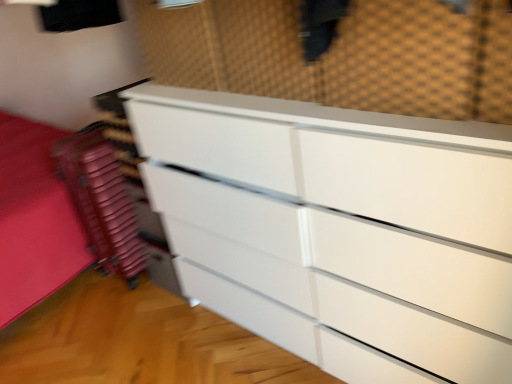
What do you see at coordinates (338, 230) in the screenshot? The height and width of the screenshot is (384, 512). I see `white glossy chest of drawers at center` at bounding box center [338, 230].

The image size is (512, 384). In order to click on white glossy chest of drawers at center in this screenshot , I will do `click(338, 230)`.

Find the location of a particular element. Image resolution: width=512 pixels, height=384 pixels. white glossy chest of drawers at center is located at coordinates (338, 230).